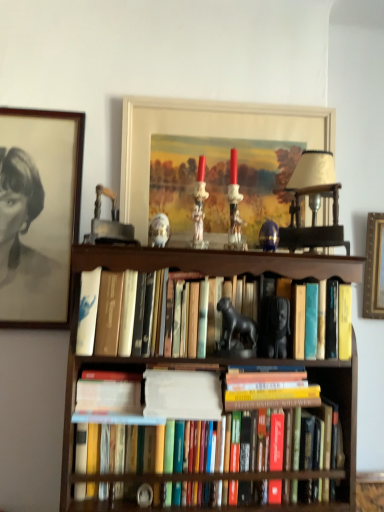
Question: Looking at the image, does porcelain figurine at center, which is the second animal from right to left, seem bigger or smaller compared to matte white picture frame at upper center, the first picture frame positioned from the right?

Choices:
 (A) big
 (B) small

Answer: (B)

Question: Choose the correct answer: Is porcelain figurine at center, marked as the first animal in a top-to-bottom arrangement, inside matte white picture frame at upper center, the second picture frame when ordered from left to right, or outside it?

Choices:
 (A) inside
 (B) outside

Answer: (B)

Question: Based on their relative distances, which object is nearer to the porcelain figurine at center, which is the second animal from right to left?

Choices:
 (A) brown wooden bookcase at center
 (B) hardcover books at center, the first book in the bottom-to-top sequence
 (C) hardcover books at center, marked as the third book in a top-to-bottom arrangement
 (D) white paper at center, which is the 2th book in top-to-bottom order
 (E) black glossy statue at center, the 2th animal in the top-to-bottom sequence

Answer: (A)

Question: Which is farther from the hardcover books at center, positioned as the second book in bottom-to-top order?

Choices:
 (A) hardcover book at center
 (B) matte white picture frame at upper center, the second picture frame when ordered from left to right
 (C) matte black portrait at upper left, placed as the 1th picture frame when sorted from left to right
 (D) porcelain figurine at center, marked as the first animal in a top-to-bottom arrangement
 (E) hardcover books at center, which is counted as the 4th book, starting from the bottom

Answer: (C)